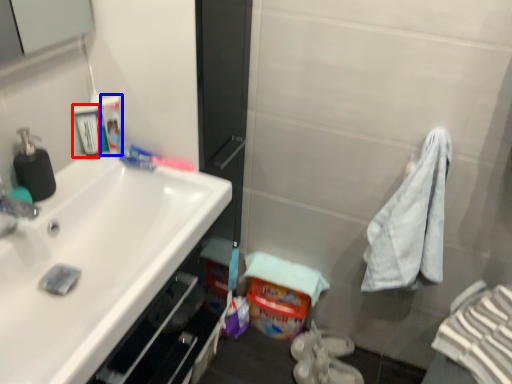
Question: Which object is closer to the camera taking this photo, mouthwash (highlighted by a red box) or mouthwash (highlighted by a blue box)?

Choices:
 (A) mouthwash
 (B) mouthwash

Answer: (A)